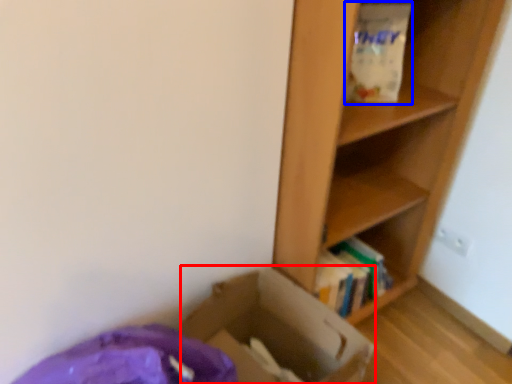
Question: Among these objects, which one is nearest to the camera, cardboard box (highlighted by a red box) or paper bag (highlighted by a blue box)?

Choices:
 (A) cardboard box
 (B) paper bag

Answer: (A)